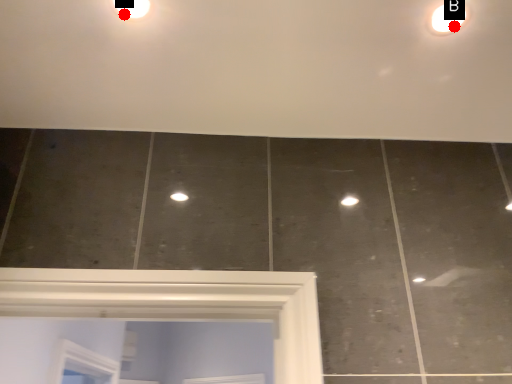
Question: Two points are circled on the image, labeled by A and B beside each circle. Which point appears farthest from the camera in this image?

Choices:
 (A) A is further
 (B) B is further

Answer: (B)